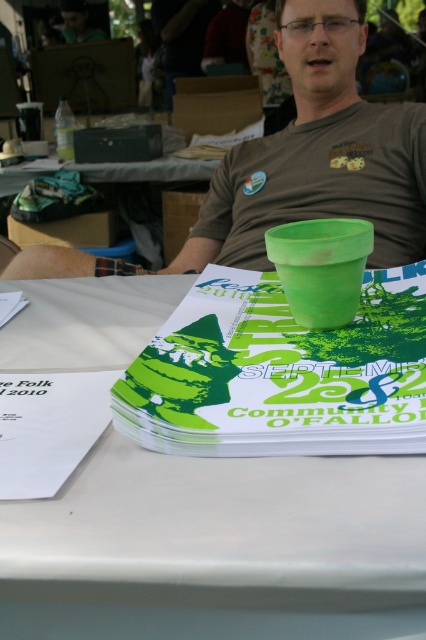
You are standing 12 inches away from the table in the scene. If you want to reach the point at coordinates point (261,596), will you be able to do so without moving closer?

The point (261,596) is 10.85 inches away from the viewer. Since you are already standing 12 inches away from the table, you are farther than the required distance. Therefore, you can reach the point without moving closer.

You are setting up for an event and need to place a 32 inch wide banner between the white paper at center and the matte green pot at upper center. Can the banner fit between them?

The distance between the white paper at center and the matte green pot at upper center is 31.82 inches. Since the banner is 32 inches wide, it will not fit between them as the space is slightly smaller.

You are a guest at the festival and want to pick up the white paper at center and the matte green pot at upper center. Which one can you reach without moving your current position?

The white paper at center is closer to the viewer than the matte green pot at upper center, so you can reach the white paper at center without moving.